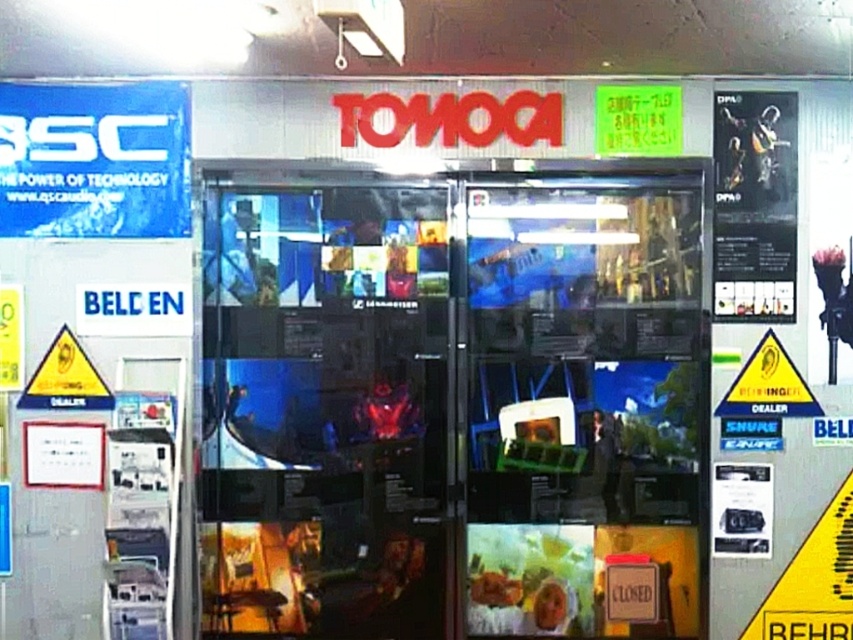
Consider the image. You are a customer entering the electronics store and looking at the signs above the entrance. Which sign is positioned to the left of the other between the blue plastic sign at upper left and the green plastic sign at upper center?

The blue plastic sign at upper left is to the left of the green plastic sign at upper center.

You are a customer entering the TONOGA electronics store and notice two signs above the entrance. The blue plastic sign at upper left and the green plastic sign at upper center. Which sign is wider?

The blue plastic sign at upper left might be wider than green plastic sign at upper center according to the description.

A customer is standing at the entrance of the TONOGA electronics store and wants to reach the point marked as point (32,161). If the customer walks straight ahead from the entrance, will they reach the point before encountering any obstacles?

The point (32,161) is 4.38 meters away from the entrance. Since the path is clear and there are no obstacles mentioned in the scene description, the customer can walk straight ahead and reach the point without any issues.